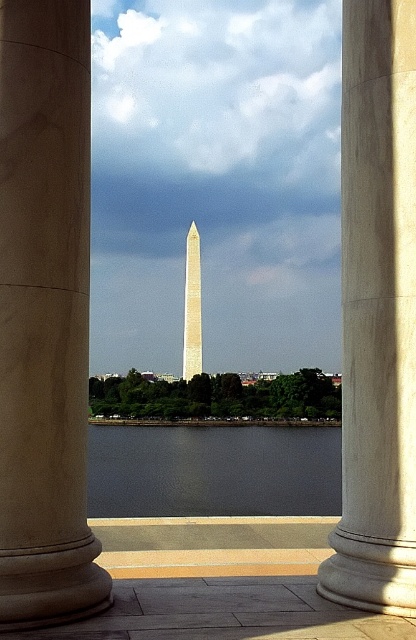
Question: Estimate the real-world distances between objects in this image. Which object is closer to the beige stone column at center?

Choices:
 (A) dark gray water at center
 (B) beige marble column at center

Answer: (B)

Question: Based on their relative distances, which object is nearer to the beige marble column at center?

Choices:
 (A) beige stone column at center
 (B) dark gray water at center
 (C) white polished stone tower at center

Answer: (A)

Question: Based on their relative distances, which object is farther from the beige stone column at center?

Choices:
 (A) dark gray water at center
 (B) white polished stone tower at center
 (C) beige marble column at center

Answer: (B)

Question: In this image, where is beige marble column at center located relative to beige stone column at center?

Choices:
 (A) left
 (B) right

Answer: (A)

Question: Does beige stone column at center have a lesser width compared to dark gray water at center?

Choices:
 (A) no
 (B) yes

Answer: (B)

Question: Does beige stone column at center have a larger size compared to white polished stone tower at center?

Choices:
 (A) yes
 (B) no

Answer: (B)